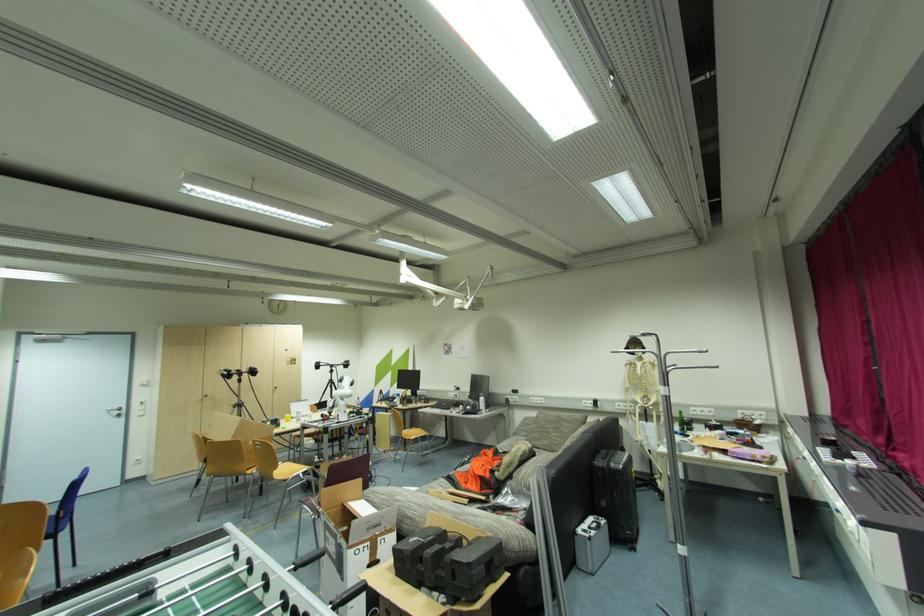
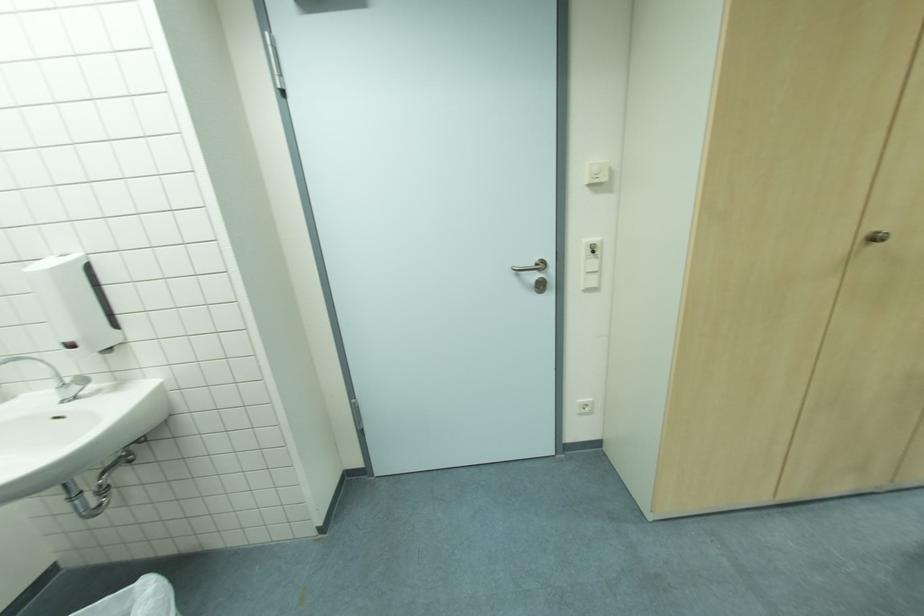
Find the pixel in the second image that matches [146,414] in the first image.

(598, 285)